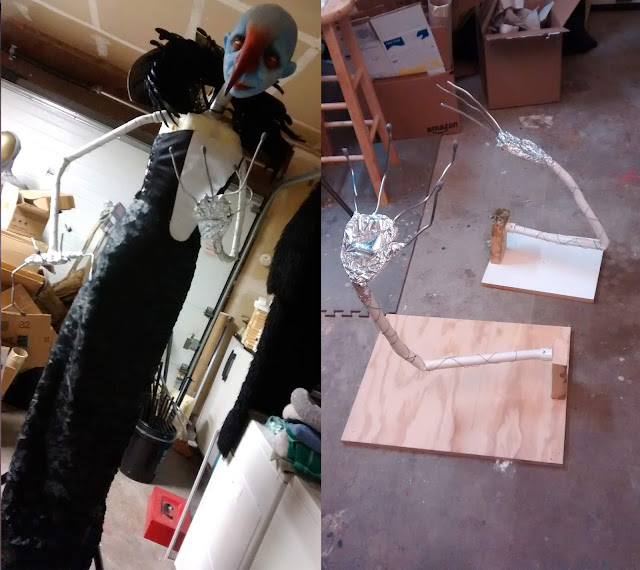
The width and height of the screenshot is (640, 570). What are the coordinates of `wooden board` in the screenshot? It's located at (491, 411).